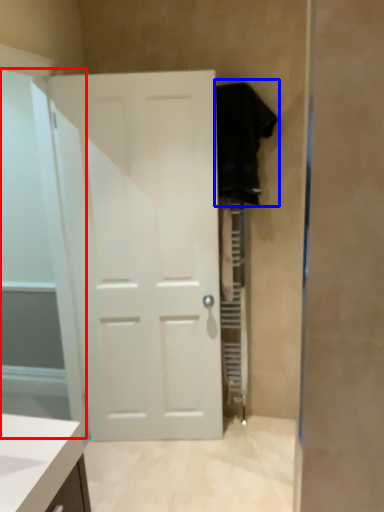
Question: Which of the following is the farthest to the observer, glass door (highlighted by a red box) or robe (highlighted by a blue box)?

Choices:
 (A) glass door
 (B) robe

Answer: (B)